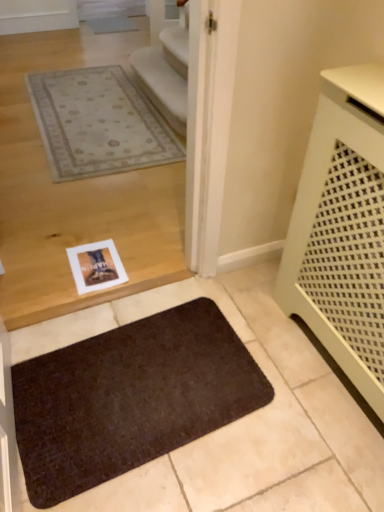
The height and width of the screenshot is (512, 384). I want to click on free space between white perforated radiator at right and brown textured mat at lower center, so click(x=239, y=418).